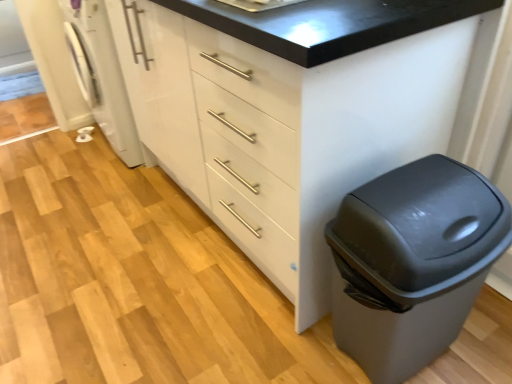
Question: Considering the positions of white glossy washing machine at left and white glossy cabinet at center in the image, is white glossy washing machine at left bigger or smaller than white glossy cabinet at center?

Choices:
 (A) big
 (B) small

Answer: (B)

Question: From a real-world perspective, is white glossy washing machine at left physically located above or below white glossy cabinet at center?

Choices:
 (A) above
 (B) below

Answer: (B)

Question: Estimate the real-world distances between objects in this image. Which object is farther from the white glossy cabinet at center?

Choices:
 (A) matte gray trash can at lower right
 (B) white glossy washing machine at left

Answer: (B)

Question: Estimate the real-world distances between objects in this image. Which object is closer to the white glossy washing machine at left?

Choices:
 (A) matte gray trash can at lower right
 (B) white glossy cabinet at center

Answer: (B)